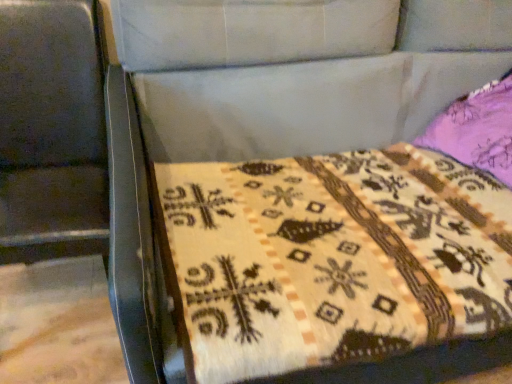
The width and height of the screenshot is (512, 384). What are the coordinates of `beige woven quilt at center` in the screenshot? It's located at (334, 258).

Measure the distance between beige woven quilt at center and camera.

beige woven quilt at center and camera are 32.11 inches apart from each other.

The image size is (512, 384). Describe the element at coordinates (334, 258) in the screenshot. I see `beige woven quilt at center` at that location.

In order to face metallic swivel chair at left, should I rotate leftwards or rightwards?

Turn left approximately 27.400 degrees to face it.

The height and width of the screenshot is (384, 512). What do you see at coordinates (51, 132) in the screenshot? I see `metallic swivel chair at left` at bounding box center [51, 132].

Identify the location of metallic swivel chair at left. (51, 132).

Locate an element on the screen. The height and width of the screenshot is (384, 512). beige woven quilt at center is located at coordinates (334, 258).

Which object is positioned more to the right, beige woven quilt at center or metallic swivel chair at left?

beige woven quilt at center.

Does beige woven quilt at center come in front of metallic swivel chair at left?

No, beige woven quilt at center is further to the viewer.

Which is behind, point (226, 333) or point (83, 11)?

The point (83, 11) is farther from the camera.

From the image's perspective, is beige woven quilt at center under metallic swivel chair at left?

Yes, from the image's perspective, beige woven quilt at center is beneath metallic swivel chair at left.

From a real-world perspective, which object stands above the other?

From a 3D spatial view, metallic swivel chair at left is above.

Considering the relative sizes of beige woven quilt at center and metallic swivel chair at left in the image provided, is beige woven quilt at center thinner than metallic swivel chair at left?

No, beige woven quilt at center is not thinner than metallic swivel chair at left.

Is beige woven quilt at center shorter than metallic swivel chair at left?

Yes.

Considering the sizes of objects beige woven quilt at center and metallic swivel chair at left in the image provided, who is bigger, beige woven quilt at center or metallic swivel chair at left?

With larger size is metallic swivel chair at left.

Could metallic swivel chair at left be considered to be inside beige woven quilt at center?

No, metallic swivel chair at left is not surrounded by beige woven quilt at center.

Is beige woven quilt at center in contact with metallic swivel chair at left?

No.

Is beige woven quilt at center aimed at metallic swivel chair at left?

No, beige woven quilt at center is not turned towards metallic swivel chair at left.

Can you tell me how much beige woven quilt at center and metallic swivel chair at left differ in facing direction?

The angle between the facing direction of beige woven quilt at center and the facing direction of metallic swivel chair at left is 4.1 degrees.

Measure the distance from beige woven quilt at center to metallic swivel chair at left.

20.63 inches.

Locate an element on the screen. The width and height of the screenshot is (512, 384). quilt that appears behind the metallic swivel chair at left is located at coordinates (334, 258).

Looking at this image, is metallic swivel chair at left at the left side of beige woven quilt at center?

Yes.

From the picture: Considering the positions of objects metallic swivel chair at left and beige woven quilt at center in the image provided, who is behind, metallic swivel chair at left or beige woven quilt at center?

beige woven quilt at center is more distant.

Considering the points (85, 185) and (458, 288), which point is in front, point (85, 185) or point (458, 288)?

Positioned in front is point (458, 288).

From the image's perspective, is metallic swivel chair at left over beige woven quilt at center?

Yes.

From a real-world perspective, is metallic swivel chair at left physically located above or below beige woven quilt at center?

metallic swivel chair at left is above beige woven quilt at center.

Looking at their sizes, would you say metallic swivel chair at left is wider or thinner than beige woven quilt at center?

In the image, metallic swivel chair at left appears to be more narrow than beige woven quilt at center.

Considering the sizes of objects metallic swivel chair at left and beige woven quilt at center in the image provided, who is shorter, metallic swivel chair at left or beige woven quilt at center?

Standing shorter between the two is beige woven quilt at center.

Which of these two, metallic swivel chair at left or beige woven quilt at center, is bigger?

With larger size is metallic swivel chair at left.

Is beige woven quilt at center inside metallic swivel chair at left?

No, beige woven quilt at center is not inside metallic swivel chair at left.

Is metallic swivel chair at left far away from beige woven quilt at center?

metallic swivel chair at left is near beige woven quilt at center, not far away.

Is beige woven quilt at center at the back of metallic swivel chair at left?

metallic swivel chair at left is not turned away from beige woven quilt at center.

Measure the distance from metallic swivel chair at left to beige woven quilt at center.

metallic swivel chair at left is 52.41 centimeters from beige woven quilt at center.

What are the coordinates of `quilt that appears below the metallic swivel chair at left (from a real-world perspective)` in the screenshot? It's located at (334, 258).

This screenshot has width=512, height=384. Identify the location of swivel chair lying above the beige woven quilt at center (from the image's perspective). (51, 132).

The height and width of the screenshot is (384, 512). Find the location of `quilt on the right of metallic swivel chair at left`. quilt on the right of metallic swivel chair at left is located at coordinates (334, 258).